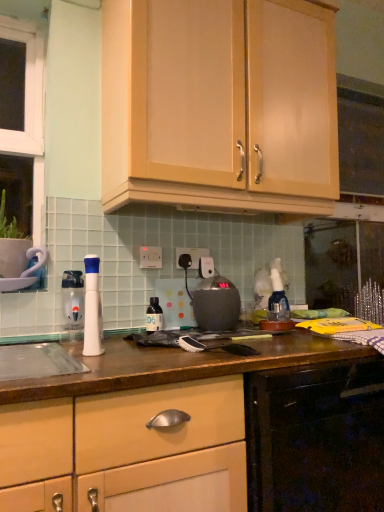
Where is `vacant space underneath matte black kettle at center (from a real-world perspective)`? vacant space underneath matte black kettle at center (from a real-world perspective) is located at coordinates (213, 325).